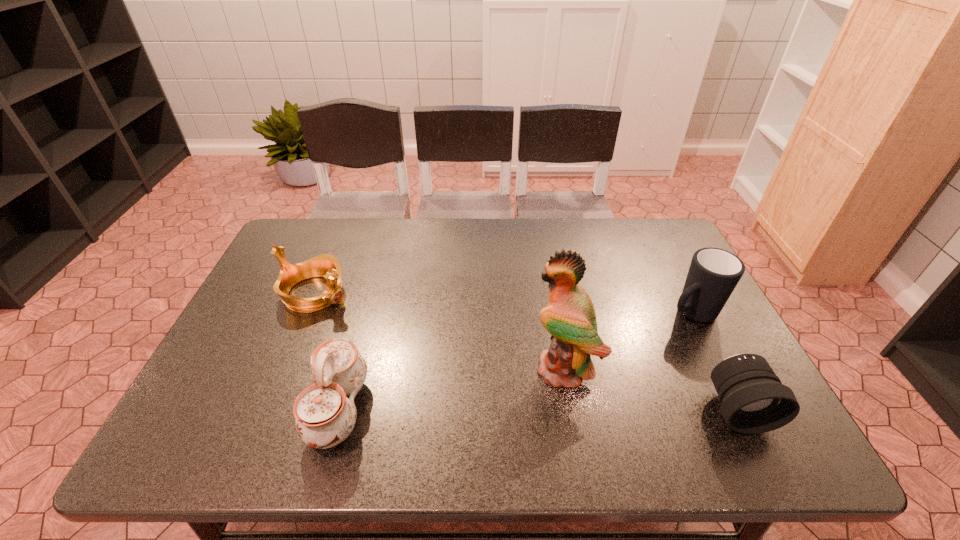
At what (x,y) coordinates should I click in order to perform the action: click on vacant space located 0.120m at the front emblem of the tiara. Please return your answer as a coordinate pair (x, y). Looking at the image, I should click on click(x=375, y=320).

Find the location of `free region located at the front emblem of the tiara`. free region located at the front emblem of the tiara is located at coordinates (434, 347).

You are a GUI agent. You are given a task and a screenshot of the screen. Output one action in this format:
    pyautogui.click(x=<x>, y=<y>)
    Task: Click on the vacant area situated on the side of the mug with the handle
    The height and width of the screenshot is (540, 960).
    Given the screenshot: What is the action you would take?
    pyautogui.click(x=556, y=390)

Where is `vacant region located 0.330m on the side of the mug with the handle`? This screenshot has height=540, width=960. vacant region located 0.330m on the side of the mug with the handle is located at coordinates (579, 377).

The height and width of the screenshot is (540, 960). I want to click on vacant space located on the side of the mug with the handle, so click(612, 357).

You are a GUI agent. You are given a task and a screenshot of the screen. Output one action in this format:
    pyautogui.click(x=<x>, y=<y>)
    Task: Click on the vacant space located 0.100m on the front-facing side of the third object from right to left
    Image resolution: width=960 pixels, height=540 pixels.
    Given the screenshot: What is the action you would take?
    pyautogui.click(x=502, y=395)

Where is `free location located on the front-facing side of the third object from right to left`? The height and width of the screenshot is (540, 960). free location located on the front-facing side of the third object from right to left is located at coordinates (498, 397).

This screenshot has width=960, height=540. I want to click on vacant point located on the front-facing side of the third object from right to left, so click(460, 417).

Where is `chinaware that is positioned at the near edge`? chinaware that is positioned at the near edge is located at coordinates (325, 417).

Where is `telephoto lens present at the near edge`? telephoto lens present at the near edge is located at coordinates (754, 400).